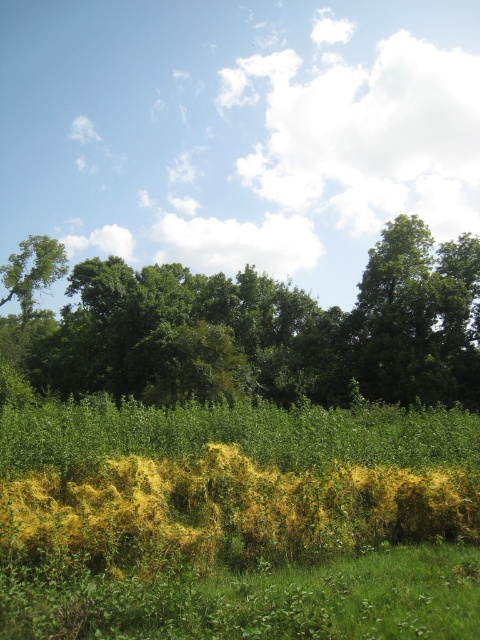
You are standing in the natural outdoor scene and want to walk towards the green leafy tree at center and the green leafy tree at upper left. Which tree will you reach first?

You will reach the green leafy tree at center first because it is closer to the viewer than the green leafy tree at upper left.

You are standing in the middle of the forest and want to climb the tallest tree. Which tree should you choose between the green leafy tree at upper right and the green leafy tree at upper left?

The green leafy tree at upper right is taller than the green leafy tree at upper left, so you should choose the green leafy tree at upper right to climb.

You are standing in the middle of the grassy area and want to walk towards the green leafy tree at upper right. Which direction should you walk to avoid the green leafy tree at center?

Since the green leafy tree at center is located below the green leafy tree at upper right, you should walk upwards to reach the green leafy tree at upper right while avoiding the green leafy tree at center.